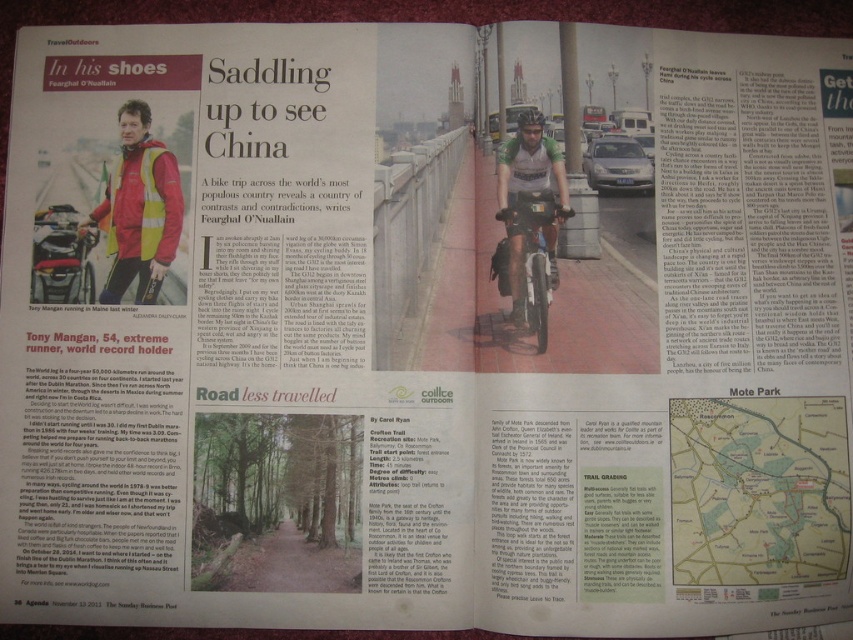
You are a photographer holding a camera and want to place a paper map at lower right next to your camera to plan your route. Is there enough space between them to fit both items comfortably?

The paper map at lower right and camera are 24.63 inches apart, so there is sufficient space to place both items comfortably next to each other.

You are a traveler who wants to compare the size of the paper map at lower right and the shiny metallic bicycle at center in the magazine spread. Which one is wider?

The paper map at lower right is wider than the shiny metallic bicycle at center because its width surpasses that of the bicycle.